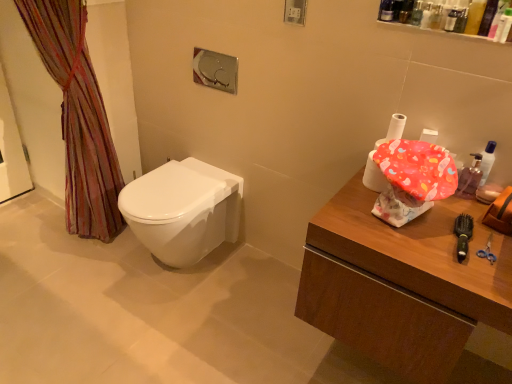
Find the location of a particular element. free space that is to the left of green plastic brush at right is located at coordinates (411, 240).